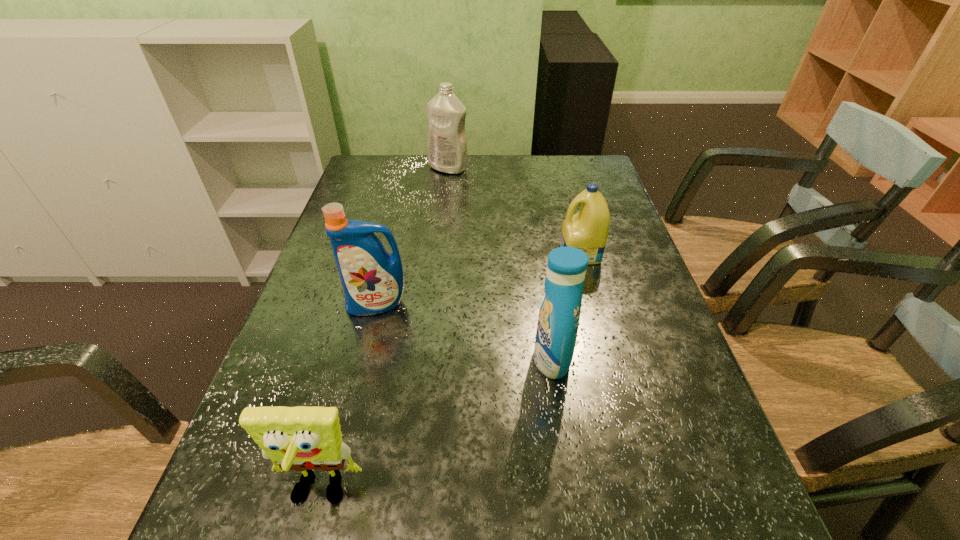
The height and width of the screenshot is (540, 960). I want to click on free space located on the front-facing side of the second nearest object, so click(x=363, y=359).

The height and width of the screenshot is (540, 960). In order to click on free spot located 0.180m on the front-facing side of the second nearest object in this screenshot , I will do `click(446, 359)`.

Where is `free space located on the label of the shortest detergent`? free space located on the label of the shortest detergent is located at coordinates (480, 254).

Image resolution: width=960 pixels, height=540 pixels. I want to click on free space located 0.400m on the label of the shortest detergent, so click(x=408, y=254).

I want to click on vacant space situated on the label of the shortest detergent, so click(x=480, y=254).

Where is `object present at the far edge`? object present at the far edge is located at coordinates coord(446,142).

The width and height of the screenshot is (960, 540). Find the location of `detergent at the left edge`. detergent at the left edge is located at coordinates (372, 279).

Where is `sponge that is at the left edge`? sponge that is at the left edge is located at coordinates (301, 438).

Where is `object located in the right edge section of the desktop`? The height and width of the screenshot is (540, 960). object located in the right edge section of the desktop is located at coordinates (587, 230).

I want to click on vacant space at the far edge of the desktop, so click(528, 173).